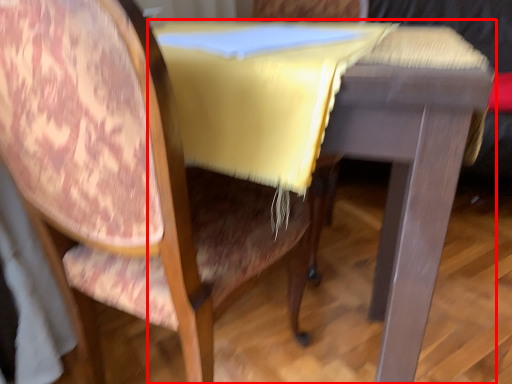
Question: From the image's perspective, where is table (annotated by the red box) located relative to chair?

Choices:
 (A) above
 (B) below

Answer: (A)